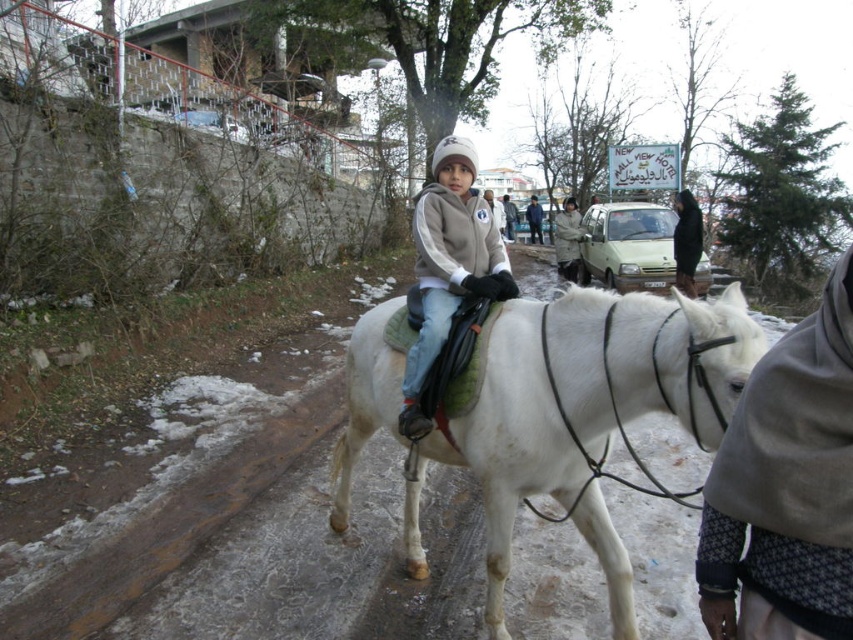
You are a delivery person who needs to deliver a package to the light brown leather jacket at center. The coordinates given are point (567, 241). Can you confirm if the jacket is located at that point?

Yes, the light brown leather jacket at center is located at point (567, 241) as stated in the description.

You are a photographer trying to capture the black fabric bag at center and the light brown leather jacket at center in a single shot. Which object should you focus on first to ensure both are in focus?

You should focus on the black fabric bag at center first since it is closer to the viewer than the light brown leather jacket at center, ensuring both will be in focus when using depth of field appropriately.

You are a delivery robot with a 2.5 meter wide package. You need to move from the light brown leather jacket at center to the blue denim jacket at center. Is there enough space for you to pass through the gap between them?

The distance between the light brown leather jacket at center and blue denim jacket at center is 5.40 meters. Since your package is 2.5 meters wide, there is sufficient space for you to pass through the gap between them.